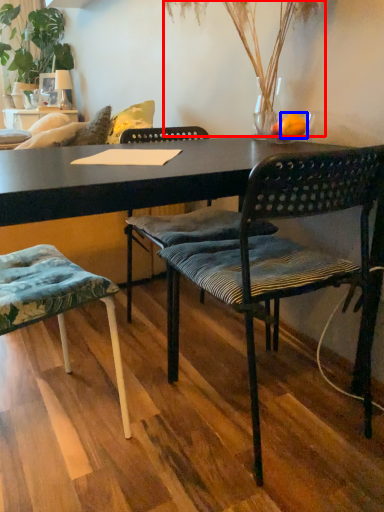
Question: Among these objects, which one is nearest to the camera, plant (highlighted by a red box) or orange (highlighted by a blue box)?

Choices:
 (A) plant
 (B) orange

Answer: (A)